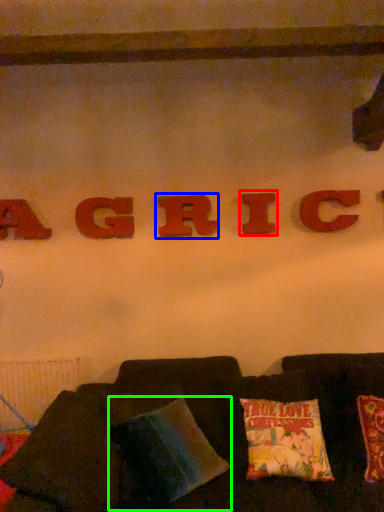
Question: Which object is the closest to the letter (highlighted by a red box)? Choose among these: letter (highlighted by a blue box) or pillow (highlighted by a green box).

Choices:
 (A) letter
 (B) pillow

Answer: (A)